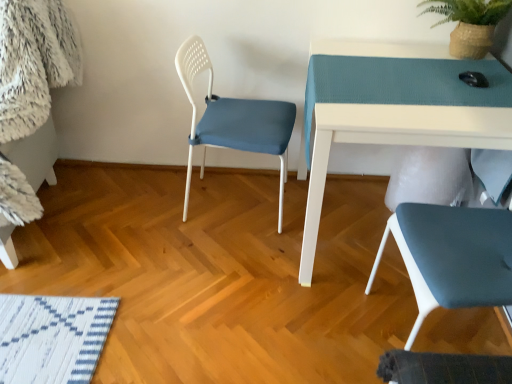
I want to click on vacant space that is in between matte blue chair at lower right, which appears as the second chair when viewed from the left, and white glossy table at upper right, so click(351, 321).